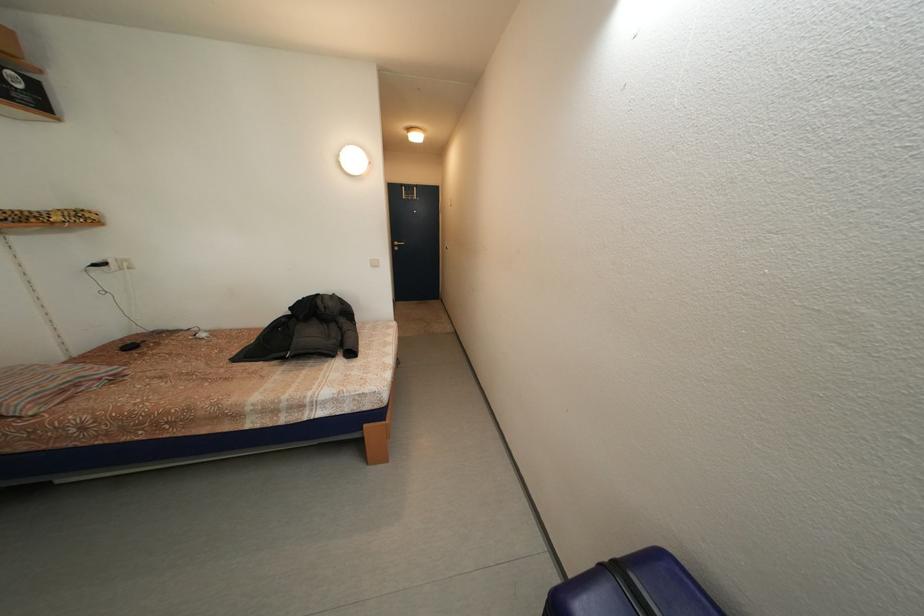
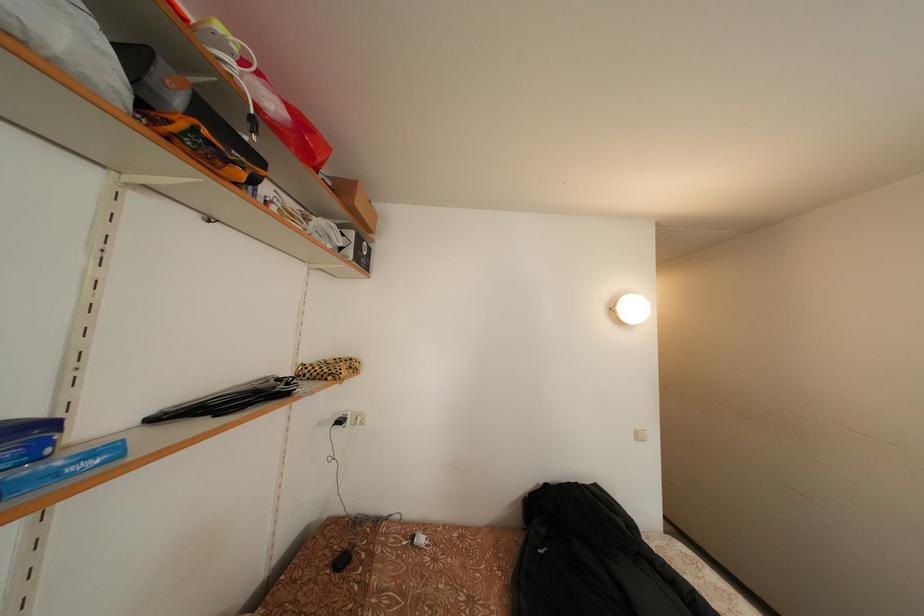
Question: In a continuous first-person perspective shot, in which direction is the camera moving?

Choices:
 (A) Left
 (B) Right
 (C) Forward
 (D) Backward

Answer: (A)